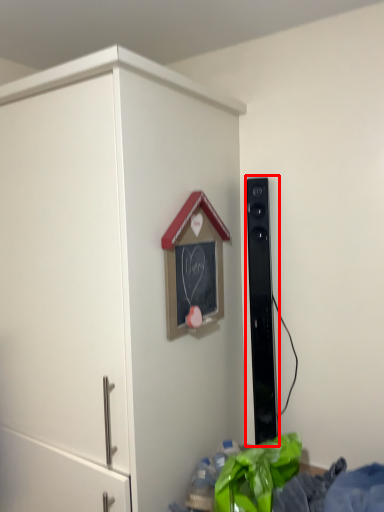
Question: From the image's perspective, considering the relative positions of speaker (annotated by the red box) and cupboard in the image provided, where is speaker (annotated by the red box) located with respect to the staircase?

Choices:
 (A) below
 (B) above

Answer: (B)